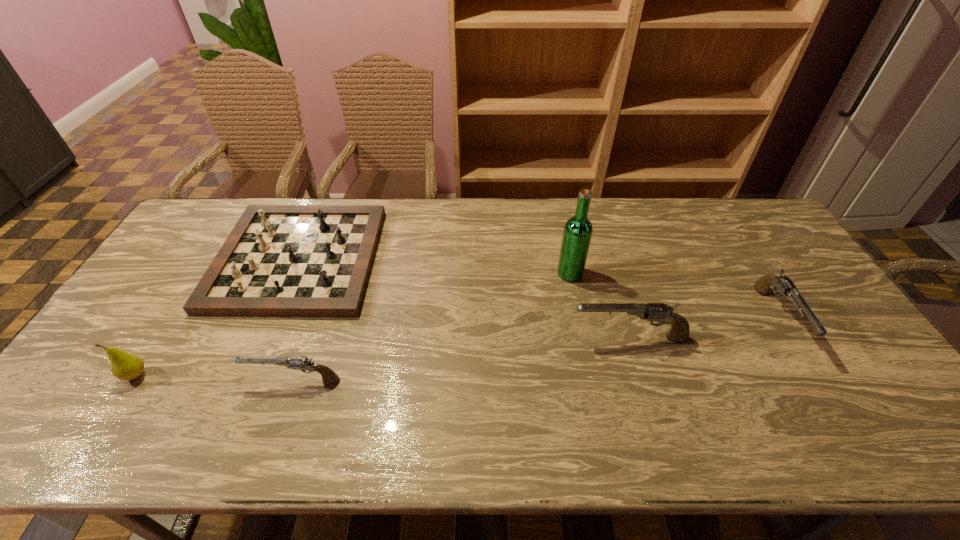
Find the location of a particular element. The image size is (960, 540). pear that is at the near edge is located at coordinates (126, 366).

This screenshot has width=960, height=540. In order to click on object located at the left edge in this screenshot , I will do `click(126, 366)`.

I want to click on object at the right edge, so click(783, 284).

Locate an element on the screen. This screenshot has width=960, height=540. object positioned at the near left corner is located at coordinates (126, 366).

This screenshot has width=960, height=540. I want to click on vacant space at the far edge of the desktop, so click(x=405, y=234).

Where is `free location at the near edge`? The image size is (960, 540). free location at the near edge is located at coordinates (432, 387).

Image resolution: width=960 pixels, height=540 pixels. I want to click on vacant position at the left edge of the desktop, so click(x=123, y=312).

Image resolution: width=960 pixels, height=540 pixels. I want to click on free space at the right edge of the desktop, so click(x=836, y=325).

This screenshot has width=960, height=540. Find the location of `free point at the far left corner`. free point at the far left corner is located at coordinates (223, 202).

Identify the location of vacant space at the near right corner of the desktop. The image size is (960, 540). (845, 408).